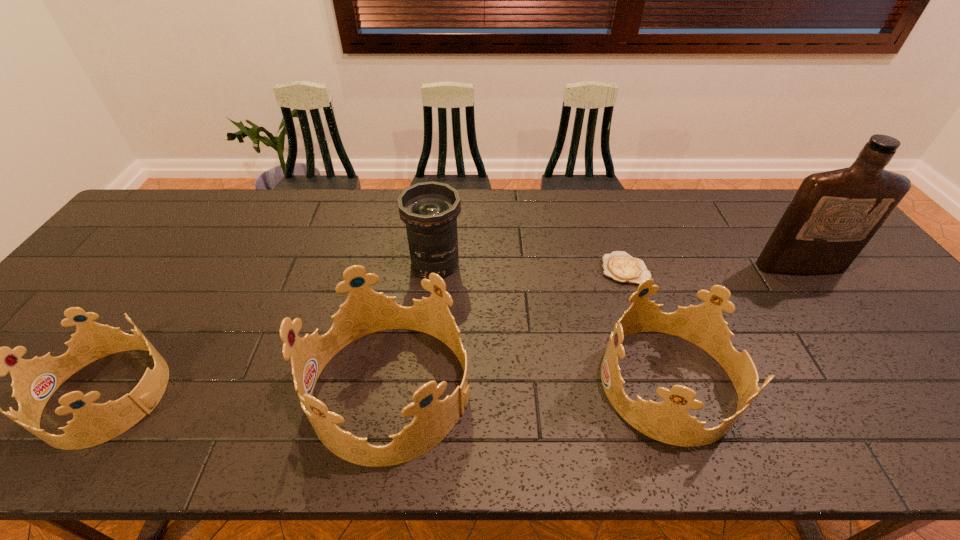
Identify the location of the leftmost tiara. [34, 381].

You are a GUI agent. You are given a task and a screenshot of the screen. Output one action in this format:
    pyautogui.click(x=<x>, y=<y>)
    Task: Click on the shortest tiara
    The height and width of the screenshot is (540, 960).
    Given the screenshot: What is the action you would take?
    pyautogui.click(x=34, y=381)

Locate an element on the screen. Image resolution: width=960 pixels, height=540 pixels. the second tiara from left to right is located at coordinates (365, 311).

Locate an element on the screen. the second tallest tiara is located at coordinates click(668, 421).

Locate an element on the screen. This screenshot has height=540, width=960. quiche is located at coordinates (620, 266).

Where is `the tallest object`? This screenshot has height=540, width=960. the tallest object is located at coordinates (834, 214).

Find the location of a particular element. Image resolution: width=960 pixels, height=540 pixels. the rightmost object is located at coordinates (834, 214).

Identify the location of telephoto lens. The height and width of the screenshot is (540, 960). (429, 210).

The width and height of the screenshot is (960, 540). In order to click on blank area located 0.110m on the front-facing side of the fifth tallest object in this screenshot , I will do `click(1, 395)`.

The width and height of the screenshot is (960, 540). Find the location of `vacant space situated on the front-facing side of the second tiara from left to right`. vacant space situated on the front-facing side of the second tiara from left to right is located at coordinates (236, 389).